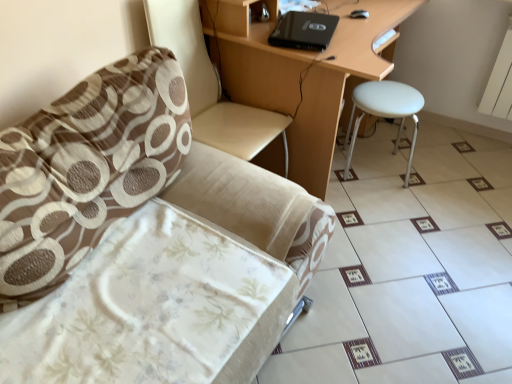
Question: Does point (480, 168) appear closer or farther from the camera than point (144, 130)?

Choices:
 (A) farther
 (B) closer

Answer: (A)

Question: From the image's perspective, is white glossy tile at lower right located above or below brown textured pillow at left?

Choices:
 (A) above
 (B) below

Answer: (B)

Question: Which object is the closest to the black matte laptop at upper center?

Choices:
 (A) beige fabric swivel chair at left
 (B) matte wood desk at center
 (C) beige fabric chair at left
 (D) white matte stool at right
 (E) brown textured pillow at left

Answer: (B)

Question: Which is farther from the brown textured pillow at left?

Choices:
 (A) white matte stool at right
 (B) beige fabric swivel chair at left
 (C) black matte laptop at upper center
 (D) white glossy tile at lower right
 (E) matte wood desk at center

Answer: (C)